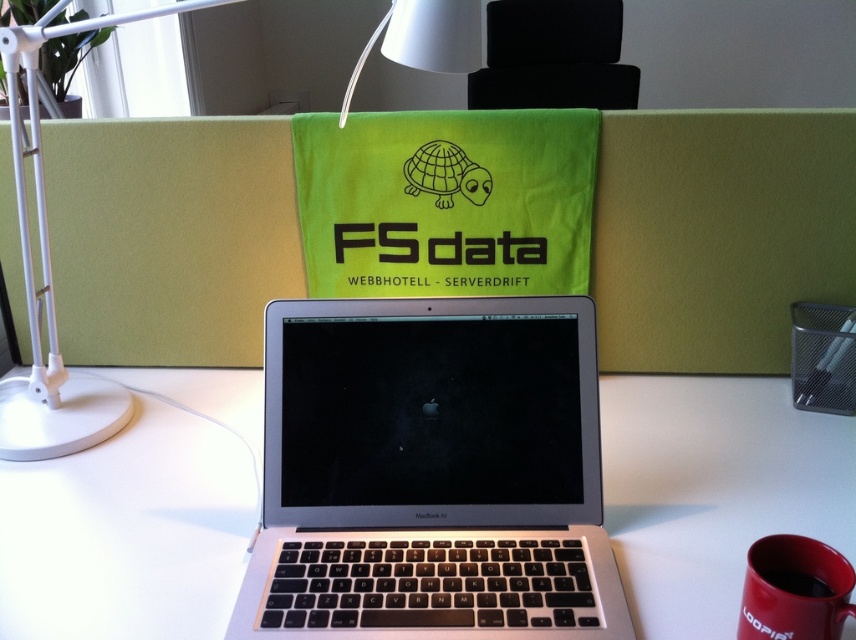
Is sleek silver laptop at center wider than matte red mug at lower right?

Indeed, sleek silver laptop at center has a greater width compared to matte red mug at lower right.

Identify the location of sleek silver laptop at center. Image resolution: width=856 pixels, height=640 pixels. (431, 474).

Does point (363, 486) come farther from viewer compared to point (816, 588)?

Yes, point (363, 486) is behind point (816, 588).

Where is `sleek silver laptop at center`? This screenshot has height=640, width=856. sleek silver laptop at center is located at coordinates (431, 474).

Can you confirm if matte red mug at lower right is shorter than black matte turtle at center?

No, matte red mug at lower right is not shorter than black matte turtle at center.

Is point (809, 632) positioned before point (480, 172)?

Yes, point (809, 632) is in front of point (480, 172).

The width and height of the screenshot is (856, 640). In order to click on matte red mug at lower right in this screenshot , I will do `click(794, 589)`.

Does sleek silver laptop at center appear under red matte coffee cup at lower right?

No.

Between point (435, 516) and point (812, 579), which one is positioned behind?

Point (435, 516)

Measure the distance between sleek silver laptop at center and camera.

sleek silver laptop at center is 26.47 inches away from camera.

Image resolution: width=856 pixels, height=640 pixels. I want to click on sleek silver laptop at center, so click(431, 474).